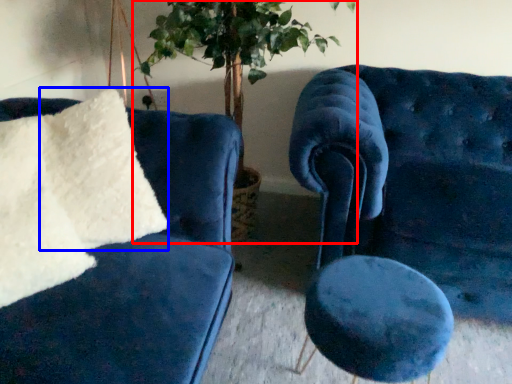
Question: Which object appears farthest to the camera in this image, houseplant (highlighted by a red box) or pillow (highlighted by a blue box)?

Choices:
 (A) houseplant
 (B) pillow

Answer: (A)